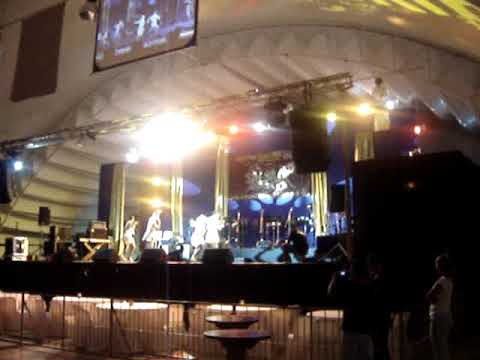
Locate an element on the screen. This screenshot has width=480, height=360. table is located at coordinates (234, 335), (233, 319).